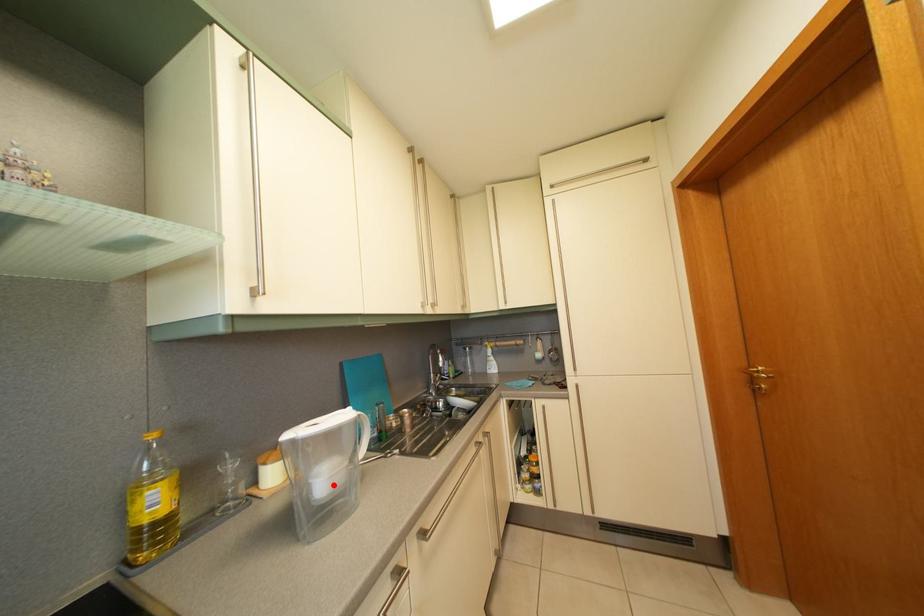
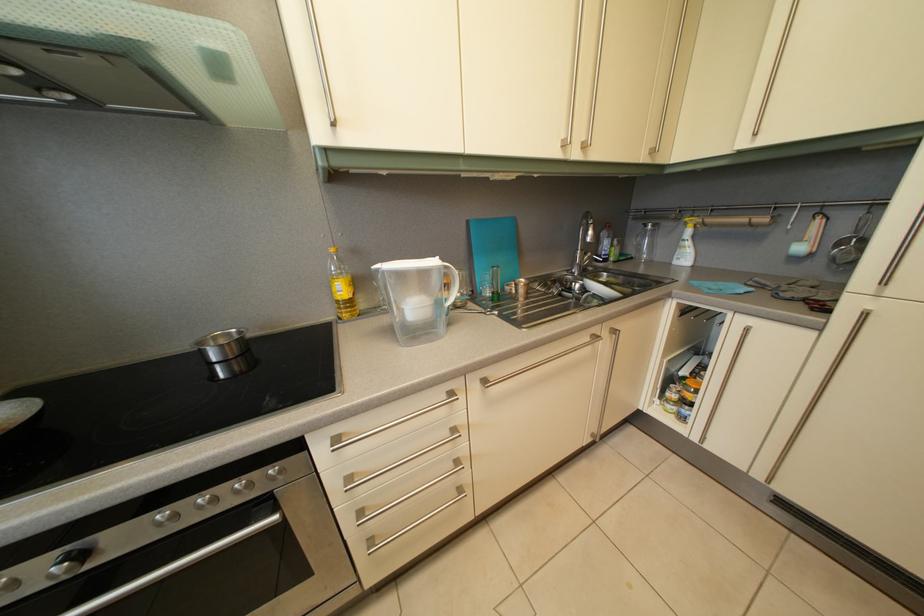
In the second image, find the point that corresponds to the highlighted location in the first image.

(421, 315)